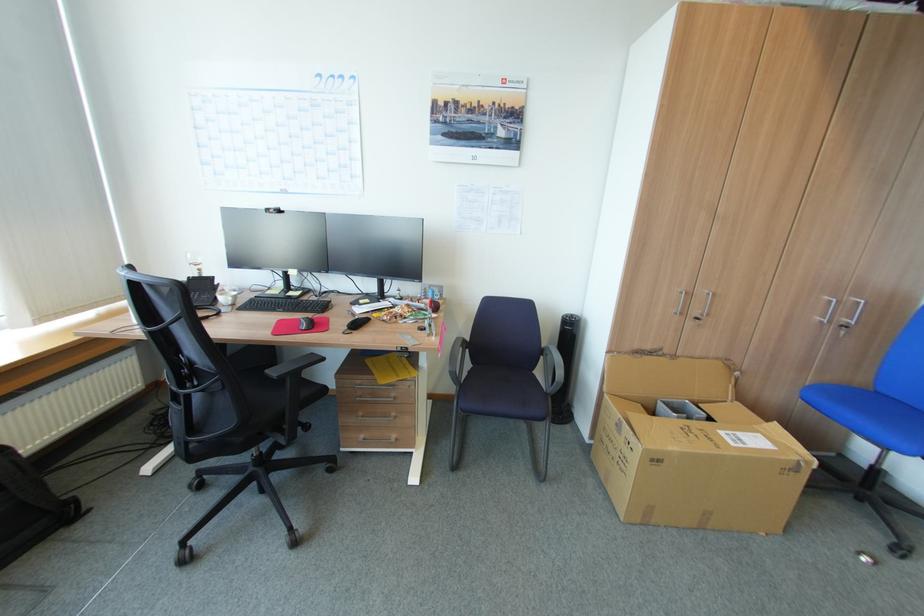
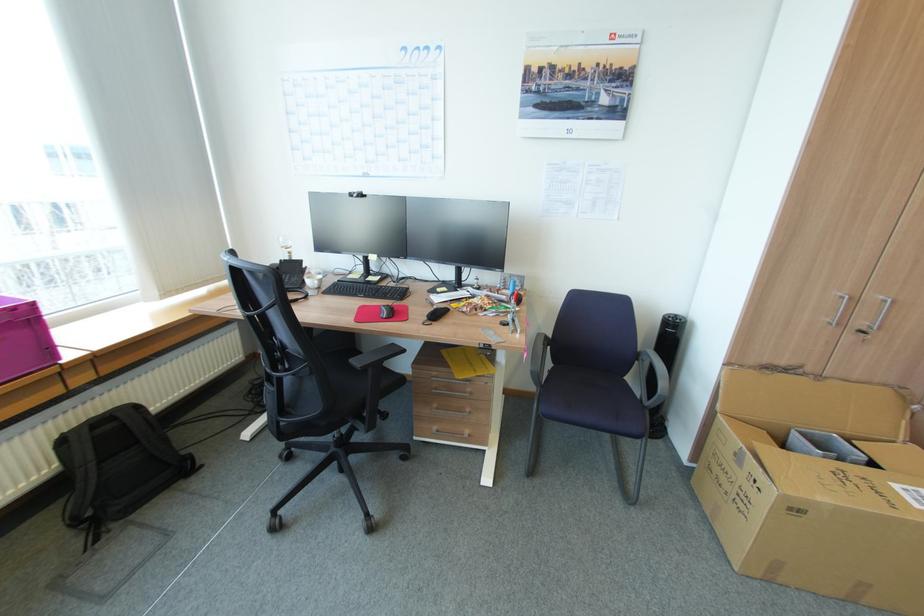
Question: The first image is from the beginning of the video and the second image is from the end. How did the camera likely rotate when shooting the video?

Choices:
 (A) Left
 (B) Right
 (C) Up
 (D) Down

Answer: (A)